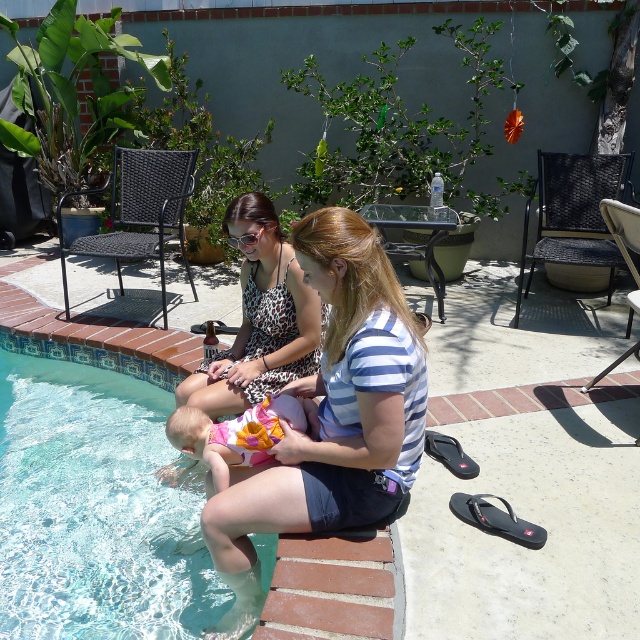
Is point (356, 388) farther from camera compared to point (188, 410)?

That is False.

Is point (358, 502) farther from camera compared to point (230, 426)?

No, it is in front of (230, 426).

Locate an element on the screen. striped cotton shirt at center is located at coordinates (332, 413).

Is point (131, 508) farther from viewer compared to point (230, 454)?

That is True.

Is point (22, 577) positioned after point (264, 406)?

Yes, it is.

Find the location of `clear glass water at lower left`. clear glass water at lower left is located at coordinates (96, 509).

Is point (157, 609) in front of point (321, 289)?

No, it is behind (321, 289).

How much distance is there between clear glass water at lower left and striped cotton shirt at center?

clear glass water at lower left is 86.43 centimeters from striped cotton shirt at center.

Who is more forward, (38, 506) or (312, 444)?

Positioned in front is point (312, 444).

This screenshot has height=640, width=640. Find the location of `clear glass water at lower left`. clear glass water at lower left is located at coordinates (96, 509).